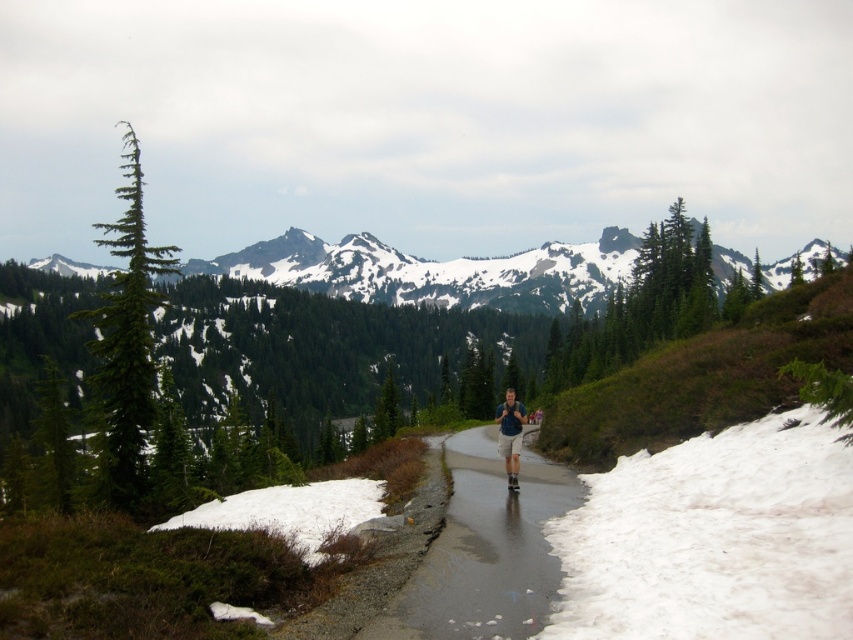
Question: Is green forested mountain at upper center further to the viewer compared to shiny asphalt road at center?

Choices:
 (A) no
 (B) yes

Answer: (B)

Question: Based on their relative distances, which object is farther from the white fluffy snow at lower left?

Choices:
 (A) blue fabric shirt at center
 (B) shiny asphalt road at center
 (C) green forested mountain at upper center
 (D) green matte pine at left

Answer: (C)

Question: Does shiny asphalt road at center appear under white fluffy snow at lower left?

Choices:
 (A) yes
 (B) no

Answer: (B)

Question: Which object is positioned farthest from the green forested mountain at upper center?

Choices:
 (A) blue fabric shirt at center
 (B) white fluffy snow at lower left
 (C) shiny asphalt road at center

Answer: (A)

Question: Which object is positioned farthest from the shiny asphalt road at center?

Choices:
 (A) white fluffy snow at lower left
 (B) blue fabric shirt at center

Answer: (A)

Question: From the image, what is the correct spatial relationship of green forested mountain at upper center in relation to blue fabric shirt at center?

Choices:
 (A) above
 (B) below

Answer: (A)